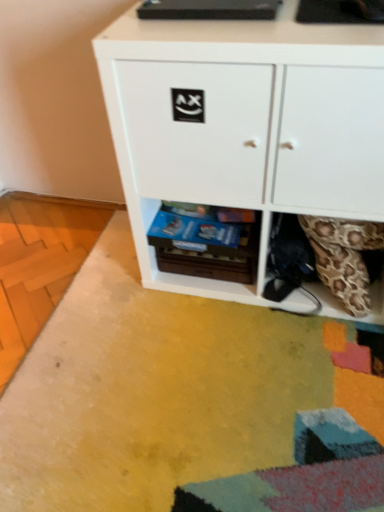
Identify the location of wooden drawer at lower center. (205, 244).

Describe the element at coordinates (205, 244) in the screenshot. The height and width of the screenshot is (512, 384). I see `wooden drawer at lower center` at that location.

The image size is (384, 512). In order to click on white matte cabinet at center in this screenshot , I will do (245, 126).

Image resolution: width=384 pixels, height=512 pixels. Describe the element at coordinates (245, 126) in the screenshot. I see `white matte cabinet at center` at that location.

Where is `wooden drawer at lower center`? wooden drawer at lower center is located at coordinates (205, 244).

Between wooden drawer at lower center and white matte cabinet at center, which one appears on the left side from the viewer's perspective?

wooden drawer at lower center is more to the left.

In the image, is wooden drawer at lower center positioned in front of or behind white matte cabinet at center?

wooden drawer at lower center is behind white matte cabinet at center.

Which point is more distant from viewer, (181, 241) or (274, 67)?

The point (181, 241) is farther from the camera.

From the image's perspective, is wooden drawer at lower center above white matte cabinet at center?

Incorrect, from the image's perspective, wooden drawer at lower center is lower than white matte cabinet at center.

From a real-world perspective, is wooden drawer at lower center over white matte cabinet at center?

No.

Does wooden drawer at lower center have a lesser width compared to white matte cabinet at center?

Yes, wooden drawer at lower center is thinner than white matte cabinet at center.

In terms of height, does wooden drawer at lower center look taller or shorter compared to white matte cabinet at center?

Result: In the image, wooden drawer at lower center appears to be shorter than white matte cabinet at center.

Can you confirm if wooden drawer at lower center is bigger than white matte cabinet at center?

No, wooden drawer at lower center is not bigger than white matte cabinet at center.

Would you say wooden drawer at lower center contains white matte cabinet at center?

No.

Is wooden drawer at lower center positioned far away from white matte cabinet at center?

No, wooden drawer at lower center is in close proximity to white matte cabinet at center.

Does wooden drawer at lower center turn towards white matte cabinet at center?

Yes.

Measure the distance from wooden drawer at lower center to white matte cabinet at center.

wooden drawer at lower center is 22.43 centimeters away from white matte cabinet at center.

The width and height of the screenshot is (384, 512). I want to click on chest of drawers in front of the wooden drawer at lower center, so click(245, 126).

Considering the positions of objects white matte cabinet at center and wooden drawer at lower center in the image provided, who is more to the left, white matte cabinet at center or wooden drawer at lower center?

Positioned to the left is wooden drawer at lower center.

Who is more distant, white matte cabinet at center or wooden drawer at lower center?

wooden drawer at lower center.

Is point (205, 175) positioned in front of point (172, 267)?

Yes, point (205, 175) is closer to viewer.

From the image's perspective, which is above, white matte cabinet at center or wooden drawer at lower center?

white matte cabinet at center appears higher in the image.

From a real-world perspective, between white matte cabinet at center and wooden drawer at lower center, who is vertically higher?

In real-world perspective, white matte cabinet at center is above.

Can you confirm if white matte cabinet at center is wider than wooden drawer at lower center?

Yes, white matte cabinet at center is wider than wooden drawer at lower center.

Is white matte cabinet at center taller or shorter than wooden drawer at lower center?

Considering their sizes, white matte cabinet at center has more height than wooden drawer at lower center.

Is white matte cabinet at center bigger than wooden drawer at lower center?

Correct, white matte cabinet at center is larger in size than wooden drawer at lower center.

Which is correct: white matte cabinet at center is inside wooden drawer at lower center, or outside of it?

white matte cabinet at center is not enclosed by wooden drawer at lower center.

Is white matte cabinet at center far away from wooden drawer at lower center?

No, there isn't a large distance between white matte cabinet at center and wooden drawer at lower center.

Does white matte cabinet at center turn towards wooden drawer at lower center?

Yes, white matte cabinet at center faces towards wooden drawer at lower center.

Can you tell me how much white matte cabinet at center and wooden drawer at lower center differ in facing direction?

The angle between the facing direction of white matte cabinet at center and the facing direction of wooden drawer at lower center is 3.22 degrees.

At what (x,y) coordinates should I click in order to perform the action: click on shelf that appears behind the white matte cabinet at center. Please return your answer as a coordinate pair (x, y). Looking at the image, I should click on (205, 244).

Locate an element on the screen. shelf behind the white matte cabinet at center is located at coordinates (205, 244).

The width and height of the screenshot is (384, 512). I want to click on shelf below the white matte cabinet at center (from a real-world perspective), so click(x=205, y=244).